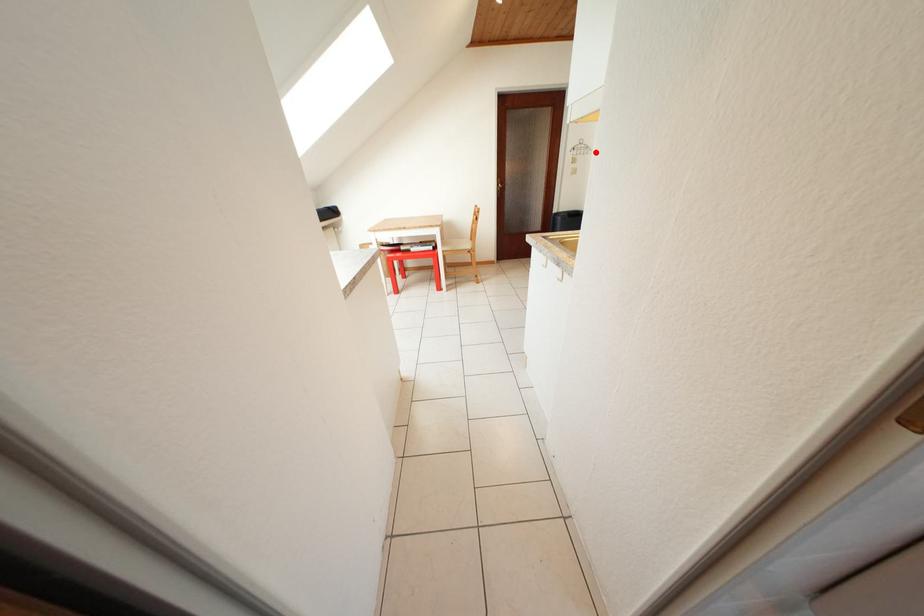
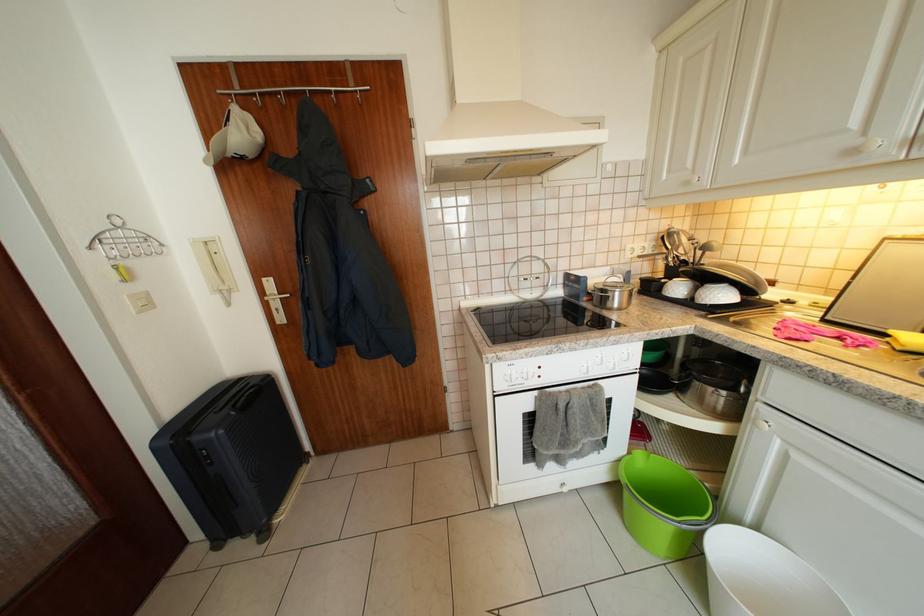
Question: I am providing you with two images of the same scene from different viewpoints. In image1, a red point is highlighted. Considering the same 3D point in image2, which of the following is correct?

Choices:
 (A) It is closer
 (B) It is farther

Answer: (B)